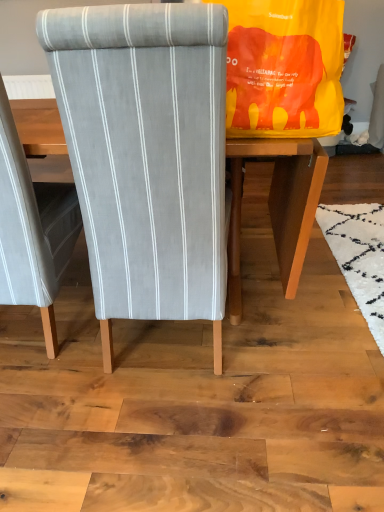
Question: Looking at the image, does gray fabric chair at center, the 1th chair from the right, seem bigger or smaller compared to yellow fabric bag at upper right?

Choices:
 (A) big
 (B) small

Answer: (A)

Question: From a real-world perspective, is gray fabric chair at center, which appears as the second chair when viewed from the left, physically located above or below yellow fabric bag at upper right?

Choices:
 (A) above
 (B) below

Answer: (B)

Question: Estimate the real-world distances between objects in this image. Which object is closer to the textured gray fabric chair at center, which is counted as the 1th chair, starting from the left?

Choices:
 (A) yellow fabric bag at upper right
 (B) gray fabric chair at center, which appears as the second chair when viewed from the left

Answer: (B)

Question: Which object is positioned closest to the textured gray fabric chair at center, which is counted as the 1th chair, starting from the left?

Choices:
 (A) gray fabric chair at center, which appears as the second chair when viewed from the left
 (B) yellow fabric bag at upper right

Answer: (A)